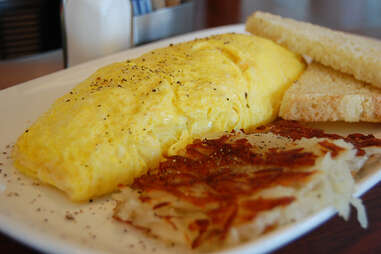
Find the location of a particular element. books is located at coordinates (137, 12), (146, 9), (149, 8), (156, 5), (171, 4).